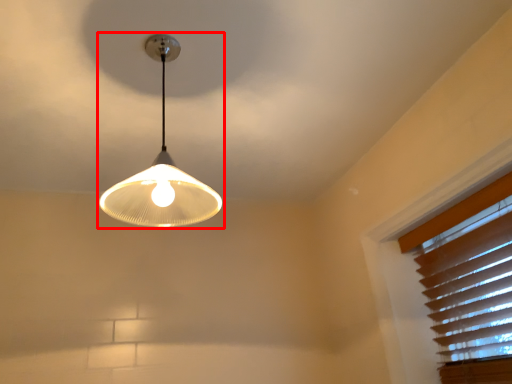
Question: In this image, where is lamp (annotated by the red box) located relative to blind?

Choices:
 (A) right
 (B) left

Answer: (B)